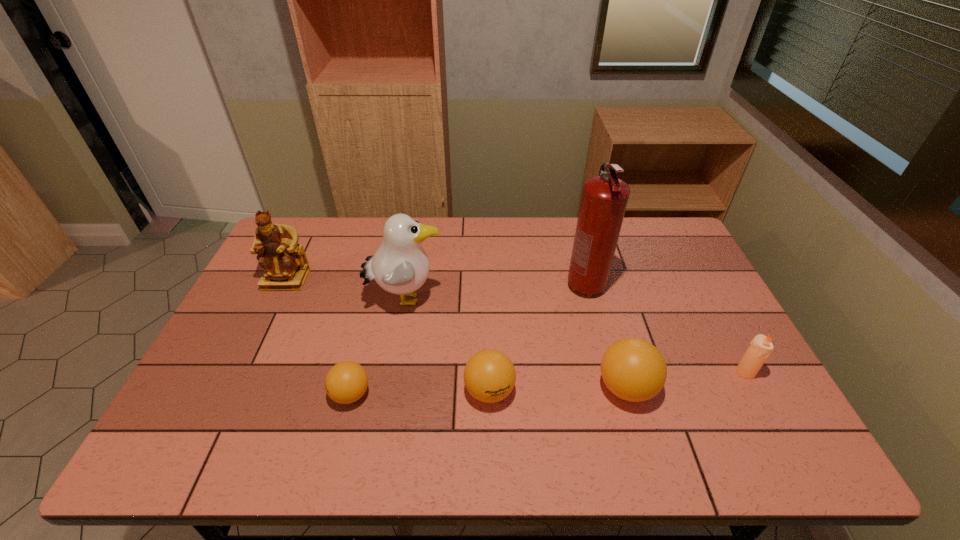
Locate an element on the screen. The width and height of the screenshot is (960, 540). free space for a new ping-pong ball on the right is located at coordinates (761, 384).